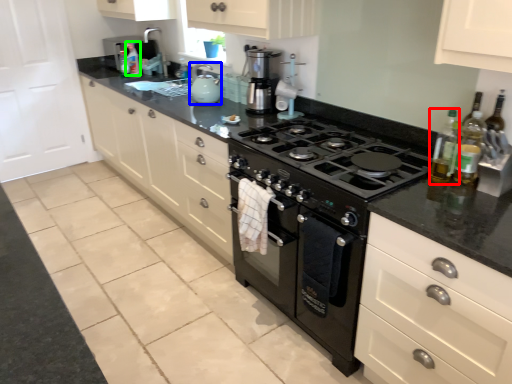
Question: Which object is positioned farthest from bottle (highlighted by a red box)? Select from kitchen appliance (highlighted by a blue box) and bottle (highlighted by a green box).

Choices:
 (A) kitchen appliance
 (B) bottle

Answer: (B)